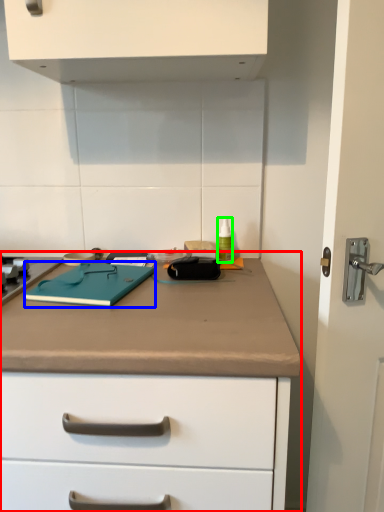
Question: Estimate the real-world distances between objects in this image. Which object is closer to counter (highlighted by a red box), notebook (highlighted by a blue box) or bottle (highlighted by a green box)?

Choices:
 (A) notebook
 (B) bottle

Answer: (A)